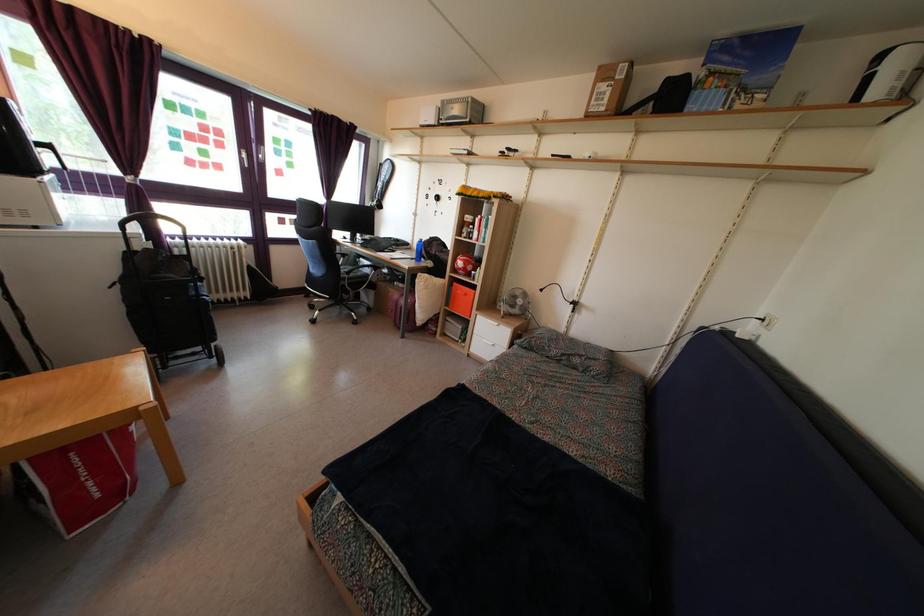
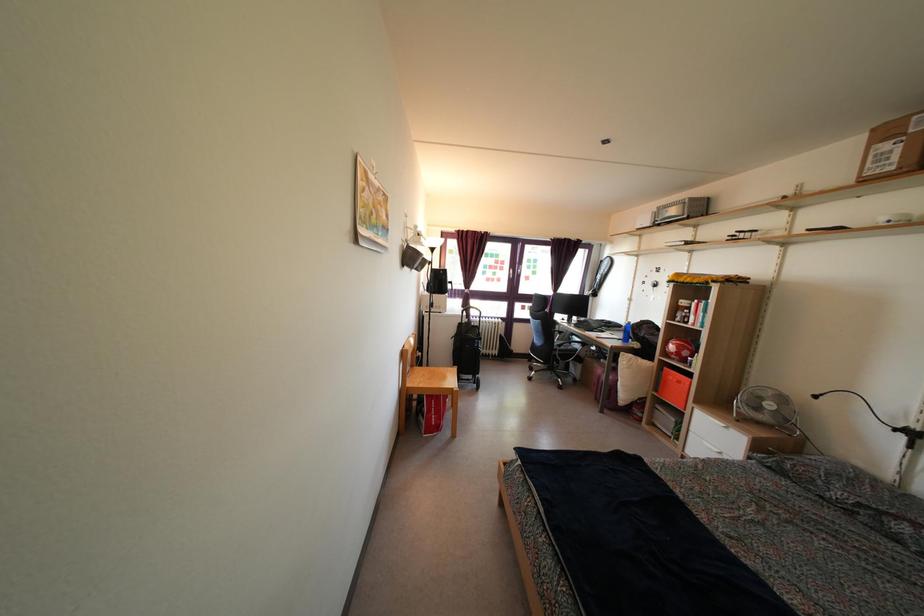
Question: The first image is from the beginning of the video and the second image is from the end. How did the camera likely rotate when shooting the video?

Choices:
 (A) Left
 (B) Right
 (C) Up
 (D) Down

Answer: (A)